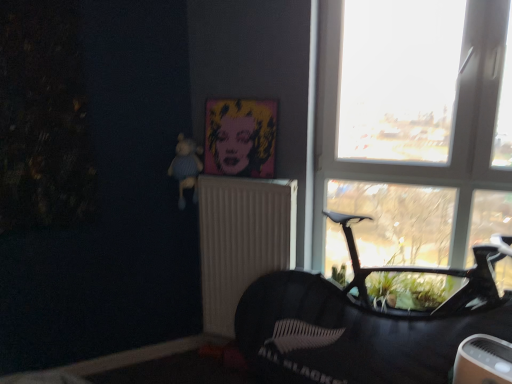
Question: Does transparent glass window at upper right turn towards white textured radiator at center?

Choices:
 (A) no
 (B) yes

Answer: (A)

Question: From the image's perspective, would you say transparent glass window at upper right is shown under white textured radiator at center?

Choices:
 (A) yes
 (B) no

Answer: (B)

Question: From a real-world perspective, is transparent glass window at upper right physically above white textured radiator at center?

Choices:
 (A) yes
 (B) no

Answer: (A)

Question: Is transparent glass window at upper right next to white textured radiator at center and touching it?

Choices:
 (A) no
 (B) yes

Answer: (A)

Question: Is transparent glass window at upper right taller than white textured radiator at center?

Choices:
 (A) yes
 (B) no

Answer: (A)

Question: Is white textured radiator at center inside transparent glass window at upper right?

Choices:
 (A) yes
 (B) no

Answer: (B)

Question: Is blue knitted bear at upper left oriented away from transparent glass window at upper right?

Choices:
 (A) yes
 (B) no

Answer: (B)

Question: Is blue knitted bear at upper left far away from transparent glass window at upper right?

Choices:
 (A) yes
 (B) no

Answer: (A)

Question: Can you confirm if blue knitted bear at upper left is taller than transparent glass window at upper right?

Choices:
 (A) yes
 (B) no

Answer: (B)

Question: From a real-world perspective, is blue knitted bear at upper left positioned over transparent glass window at upper right based on gravity?

Choices:
 (A) yes
 (B) no

Answer: (B)

Question: Is the position of blue knitted bear at upper left more distant than that of transparent glass window at upper right?

Choices:
 (A) yes
 (B) no

Answer: (A)

Question: Is the depth of blue knitted bear at upper left less than that of transparent glass window at upper right?

Choices:
 (A) no
 (B) yes

Answer: (A)

Question: Is pop art canvas at upper center positioned with its back to transparent glass window at upper right?

Choices:
 (A) yes
 (B) no

Answer: (B)